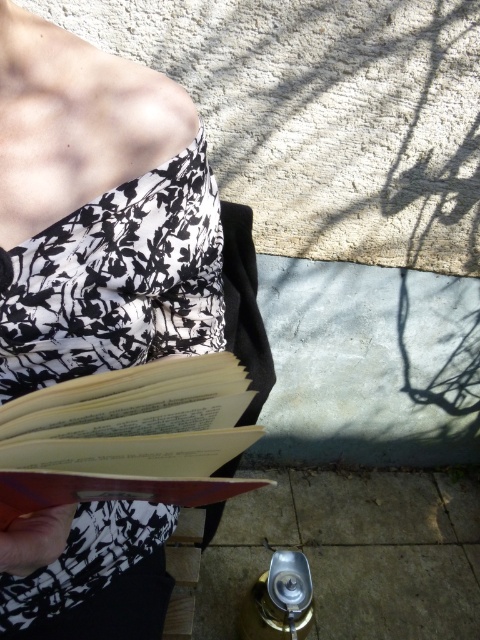
You are a photographer trying to capture the black floral fabric dress at center and the light brown paper book at center in a single shot. Based on their sizes, which object should you focus on first to ensure both are in frame?

The black floral fabric dress at center is much taller than the light brown paper book at center, so you should focus on the black floral fabric dress at center first to ensure both are in frame.

You are a photographer trying to capture a close shot of the light brown paper book at center without the black floral fabric dress at center blocking it. Given that the two objects are 8.59 inches apart, can you estimate if you can focus solely on the book while keeping the dress out of the frame?

The black floral fabric dress at center and light brown paper book at center are 8.59 inches apart. To determine if the dress can be excluded from the frame while focusing on the book, the photographer must consider the camera lens and aperture settings. A smaller aperture increases depth of field, potentially keeping both objects in focus if they are within the same plane. However, since they are 8.59 inches apart, using a wide aperture could blur the dress slightly, but physical positioning is key. Moving